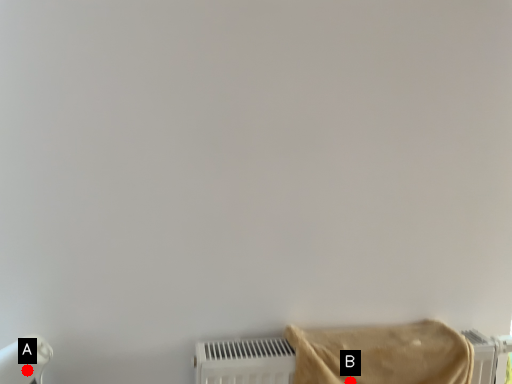
Question: Two points are circled on the image, labeled by A and B beside each circle. Which of the following is the closest to the observer?

Choices:
 (A) A is closer
 (B) B is closer

Answer: (A)